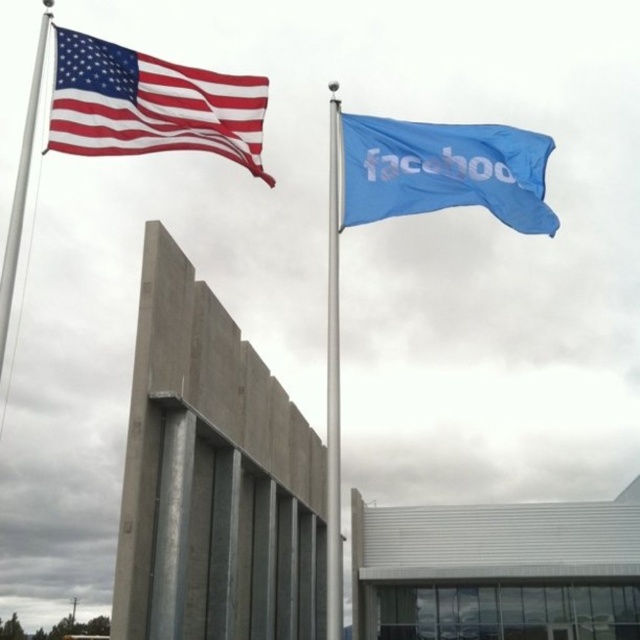
You are standing in front of the building with two flags. There are two points marked in the scene. Point A is at coordinates point (208, 145) and Point B is at point (3, 259). Which point is closer to you?

Point B at point (3, 259) is closer to you because it is less further to the camera than point A at point (208, 145).